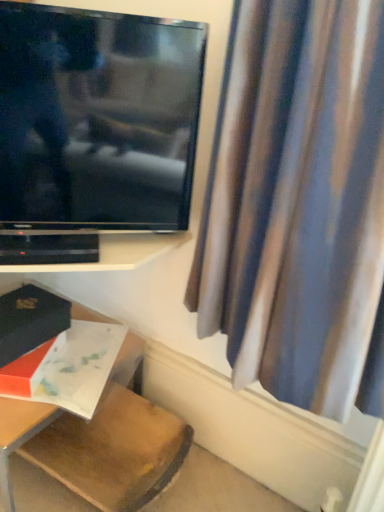
The width and height of the screenshot is (384, 512). I want to click on free space above matte black book at lower left, which is counted as the first book, starting from the top (from a real-world perspective), so click(22, 303).